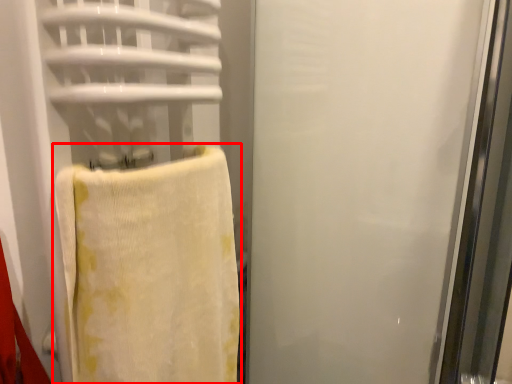
Question: From the image, what is the correct spatial relationship of towel (annotated by the red box) in relation to screen door?

Choices:
 (A) right
 (B) left

Answer: (B)